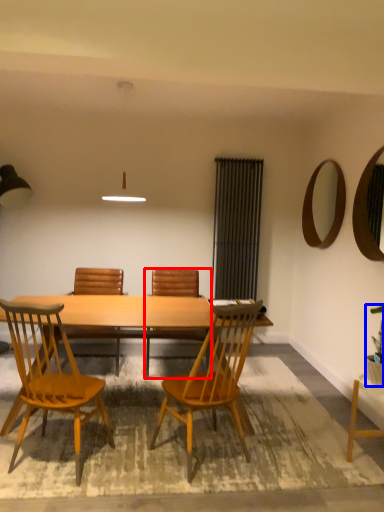
Question: Among these objects, which one is farthest to the camera, chair (highlighted by a red box) or houseplant (highlighted by a blue box)?

Choices:
 (A) chair
 (B) houseplant

Answer: (A)